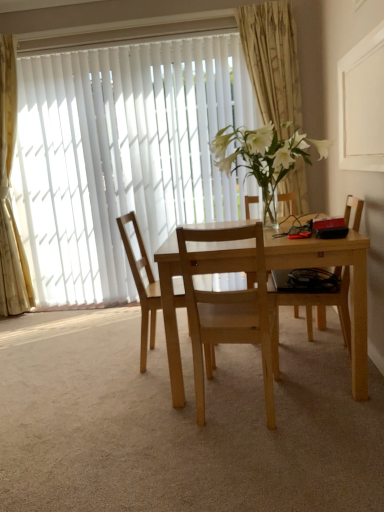
This screenshot has width=384, height=512. What are the coordinates of `empty space that is ontop of white vertical blinds at upper left (from a real-world perspective)` in the screenshot? It's located at (112, 37).